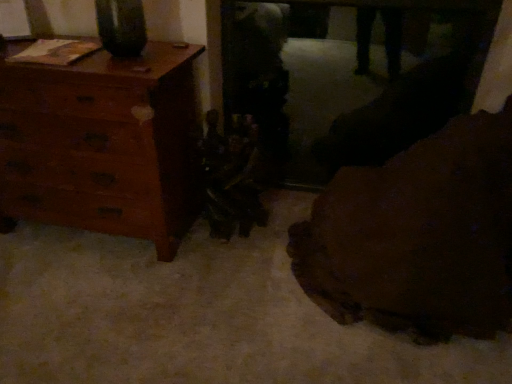
Where is `wooden dresser at left`? Image resolution: width=512 pixels, height=384 pixels. wooden dresser at left is located at coordinates (103, 145).

The height and width of the screenshot is (384, 512). What do you see at coordinates (103, 145) in the screenshot?
I see `wooden dresser at left` at bounding box center [103, 145].

In the scene shown: What is the approximate width of wooden dresser at left?

It is 20.20 inches.

What is the approximate height of brown leather couch at lower right?

brown leather couch at lower right is 32.88 inches tall.

Describe the element at coordinates (418, 236) in the screenshot. Image resolution: width=512 pixels, height=384 pixels. I see `brown leather couch at lower right` at that location.

I want to click on brown leather couch at lower right, so click(418, 236).

In order to click on wooden dresser at left in this screenshot , I will do `click(103, 145)`.

Does wooden dresser at left appear on the right side of brown leather couch at lower right?

No, wooden dresser at left is not to the right of brown leather couch at lower right.

Between wooden dresser at left and brown leather couch at lower right, which one is positioned behind?

Positioned behind is wooden dresser at left.

Is point (117, 231) positioned before point (389, 292)?

No, it is behind (389, 292).

From the image's perspective, is wooden dresser at left located above or below brown leather couch at lower right?

From the image's perspective, wooden dresser at left appears above brown leather couch at lower right.

From a real-world perspective, is wooden dresser at left beneath brown leather couch at lower right?

Yes.

Is wooden dresser at left wider or thinner than brown leather couch at lower right?

Considering their sizes, wooden dresser at left looks slimmer than brown leather couch at lower right.

Considering the sizes of wooden dresser at left and brown leather couch at lower right in the image, is wooden dresser at left taller or shorter than brown leather couch at lower right?

Clearly, wooden dresser at left is taller compared to brown leather couch at lower right.

Is wooden dresser at left smaller than brown leather couch at lower right?

Correct, wooden dresser at left occupies less space than brown leather couch at lower right.

Do you think wooden dresser at left is within brown leather couch at lower right, or outside of it?

wooden dresser at left is not enclosed by brown leather couch at lower right.

Is wooden dresser at left touching brown leather couch at lower right?

They are not placed beside each other.

Is brown leather couch at lower right at the back of wooden dresser at left?

No, wooden dresser at left is not facing the opposite direction of brown leather couch at lower right.

You are a GUI agent. You are given a task and a screenshot of the screen. Output one action in this format:
    pyautogui.click(x=<x>, y=<y>)
    Task: Click on the furniture in front of the wooden dresser at left
    
    Given the screenshot: What is the action you would take?
    pyautogui.click(x=418, y=236)

Is brown leather couch at lower right to the right of wooden dresser at left from the viewer's perspective?

Yes.

Which is in front, brown leather couch at lower right or wooden dresser at left?

brown leather couch at lower right is closer to the camera.

Which is closer to the camera, (472, 141) or (60, 205)?

Point (472, 141) is closer to the camera than point (60, 205).

From the image's perspective, which one is positioned higher, brown leather couch at lower right or wooden dresser at left?

wooden dresser at left appears higher in the image.

From a real-world perspective, which is physically below, brown leather couch at lower right or wooden dresser at left?

Answer: wooden dresser at left, from a real-world perspective.

Considering the sizes of objects brown leather couch at lower right and wooden dresser at left in the image provided, who is wider, brown leather couch at lower right or wooden dresser at left?

brown leather couch at lower right is wider.

Considering the sizes of objects brown leather couch at lower right and wooden dresser at left in the image provided, who is shorter, brown leather couch at lower right or wooden dresser at left?

brown leather couch at lower right is shorter.

Who is bigger, brown leather couch at lower right or wooden dresser at left?

brown leather couch at lower right is bigger.

Is wooden dresser at left a part of brown leather couch at lower right?

Actually, wooden dresser at left is outside brown leather couch at lower right.

Is the surface of brown leather couch at lower right in direct contact with wooden dresser at left?

No.

Is brown leather couch at lower right facing away from wooden dresser at left?

That's not correct — brown leather couch at lower right is not looking away from wooden dresser at left.

From the picture: How different are the orientations of brown leather couch at lower right and wooden dresser at left in degrees?

89.6 degrees separate the facing orientations of brown leather couch at lower right and wooden dresser at left.

You are a GUI agent. You are given a task and a screenshot of the screen. Output one action in this format:
    pyautogui.click(x=<x>, y=<y>)
    Task: Click on the furniture that is below the wooden dresser at left (from the image's perspective)
    This screenshot has width=512, height=384.
    Given the screenshot: What is the action you would take?
    pyautogui.click(x=418, y=236)

Find the location of a particular element. Image resolution: width=512 pixels, height=384 pixels. chest of drawers behind the brown leather couch at lower right is located at coordinates (103, 145).

You are a GUI agent. You are given a task and a screenshot of the screen. Output one action in this format:
    pyautogui.click(x=<x>, y=<y>)
    Task: Click on the chest of drawers on the left of brown leather couch at lower right
    This screenshot has width=512, height=384.
    Given the screenshot: What is the action you would take?
    pyautogui.click(x=103, y=145)